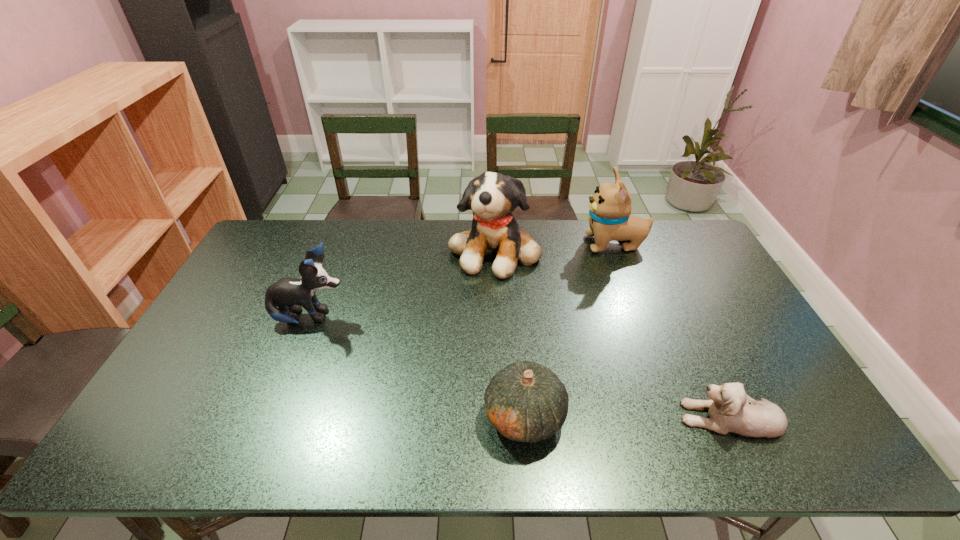
Where is `vacant area at the near left corner`? vacant area at the near left corner is located at coordinates (154, 447).

In the image, there is a desktop. Identify the location of vacant space at the far right corner. The width and height of the screenshot is (960, 540). click(x=656, y=230).

Identify the location of vacant space that's between the third farthest object and the second puppy from left to right. (402, 284).

Locate an element on the screen. Image resolution: width=960 pixels, height=540 pixels. free spot between the second puppy from left to right and the nearest puppy is located at coordinates (612, 333).

I want to click on free point between the second shortest object and the nearest puppy, so click(x=628, y=416).

Where is `free spot between the fourth tallest object and the third puppy from right to left`? The image size is (960, 540). free spot between the fourth tallest object and the third puppy from right to left is located at coordinates (510, 333).

You are a GUI agent. You are given a task and a screenshot of the screen. Output one action in this format:
    pyautogui.click(x=<x>, y=<y>)
    Task: Click on the vacant space that's between the second puppy from left to right and the shortest puppy
    This screenshot has height=540, width=960.
    Given the screenshot: What is the action you would take?
    pyautogui.click(x=612, y=333)

Identify the location of vacant area between the gourd and the leftmost puppy. (x=418, y=367).

The height and width of the screenshot is (540, 960). In order to click on vacant space that is in between the leftmost object and the fourth tallest object in this screenshot , I will do `click(418, 367)`.

This screenshot has height=540, width=960. In order to click on free point between the shortest object and the second shortest object in this screenshot , I will do `click(628, 416)`.